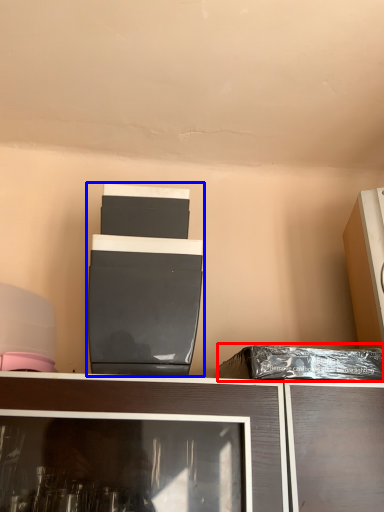
Question: Which of the following is the closest to the observer, garbage (highlighted by a red box) or appliance (highlighted by a blue box)?

Choices:
 (A) garbage
 (B) appliance

Answer: (B)